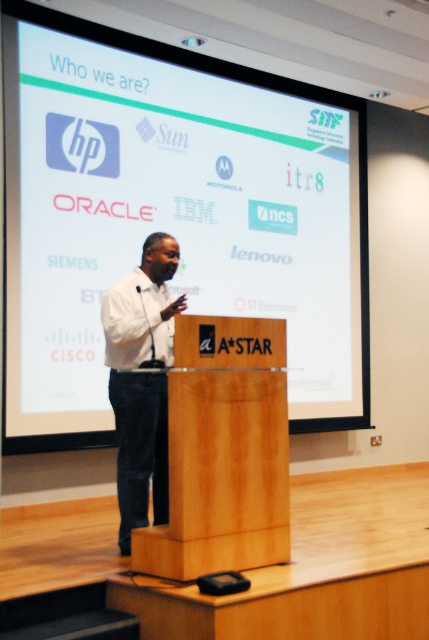
You are an attendee sitting in the front row of the conference room. You notice the wooden podium at center and the white matte shirt at center. Which object is closer to you?

The wooden podium at center is closer to you because it is in front of the white matte shirt at center.

You are an attendee at the presentation and need to take a photo of the slide on the white matte projection screen at upper center. To ensure the slide is in focus, where should you aim the camera? Please provide coordinates based on the image grid system used in the description.

The white matte projection screen at upper center is located at coordinates point (172, 216), so you should aim the camera at that point to capture the slide in focus.